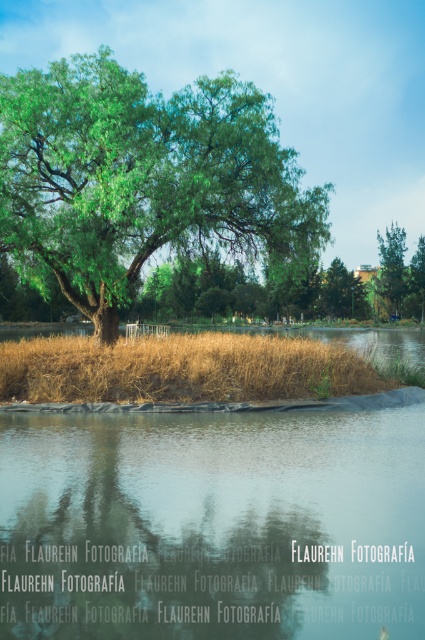
You are a painter standing in front of the scene. You want to paint the transparent glass water at lower center and the dry grass at center. Which object has a smaller width in the scene?

The transparent glass water at lower center has a lesser width compared to dry grass at center, so the transparent glass water at lower center has a smaller width in the scene.

You are standing in the serene natural scene described. You notice a point at coordinates point (214,524). What object is located at that point?

The transparent glass water at lower center is located at point (214,524).